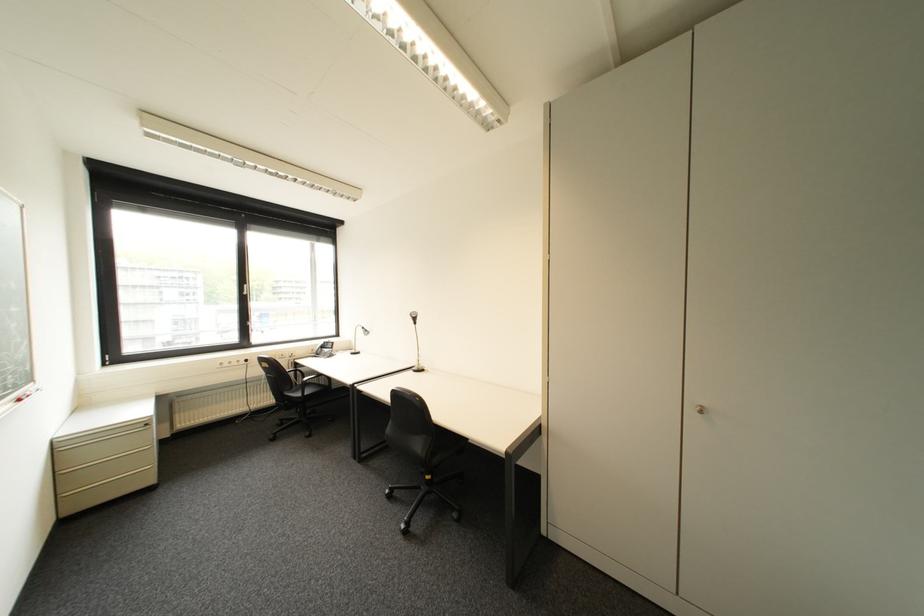
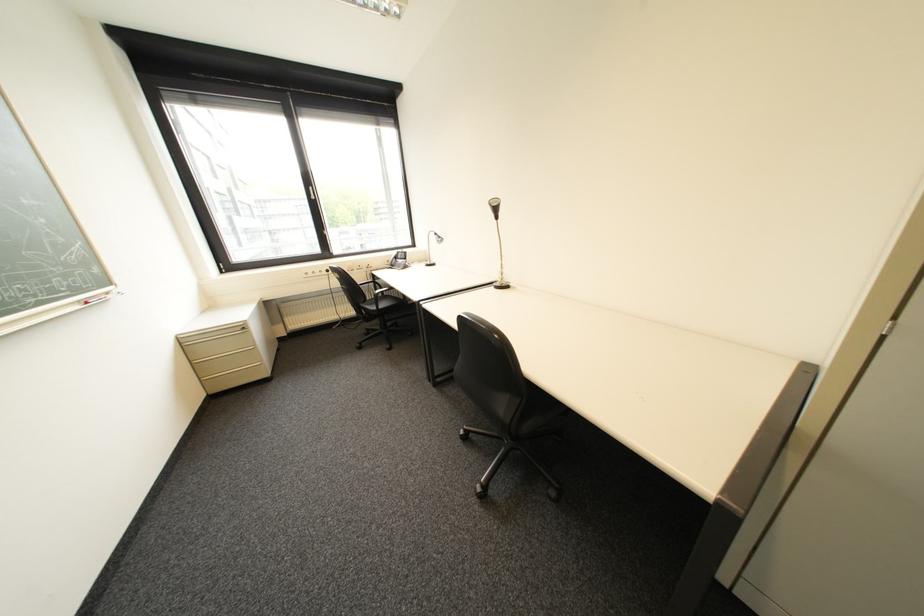
First-person continuous shooting, in which direction is the camera rotating?

The rotation direction of the camera is left-down.